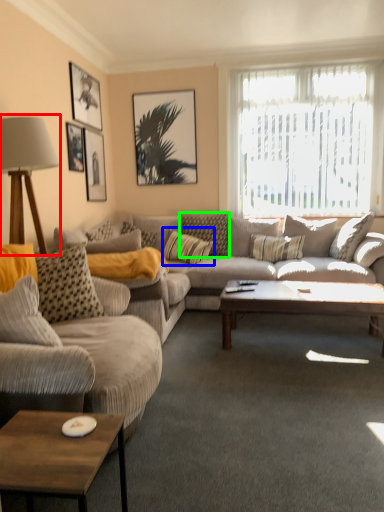
Question: Estimate the real-world distances between objects in this image. Which object is closer to table lamp (highlighted by a red box), pillow (highlighted by a blue box) or pillow (highlighted by a green box)?

Choices:
 (A) pillow
 (B) pillow

Answer: (A)